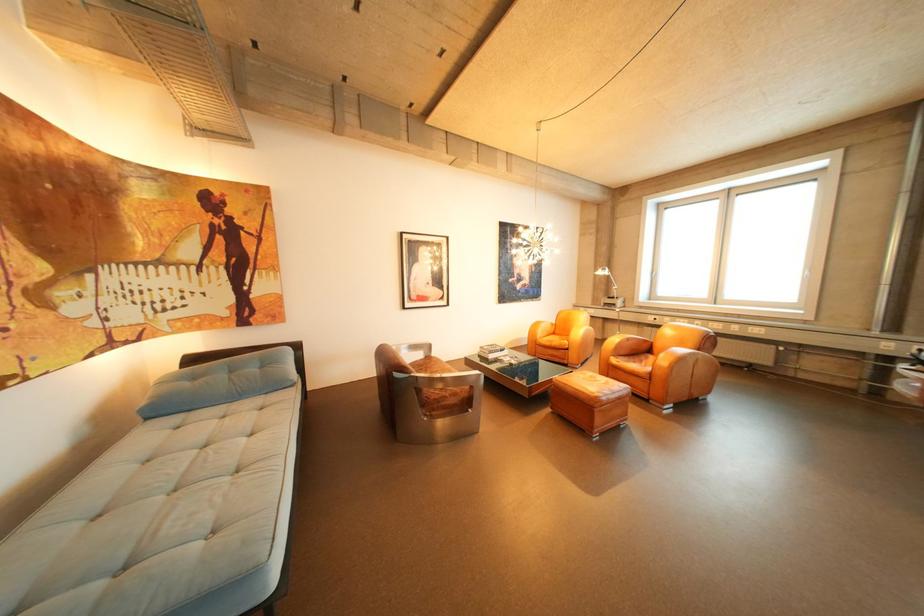
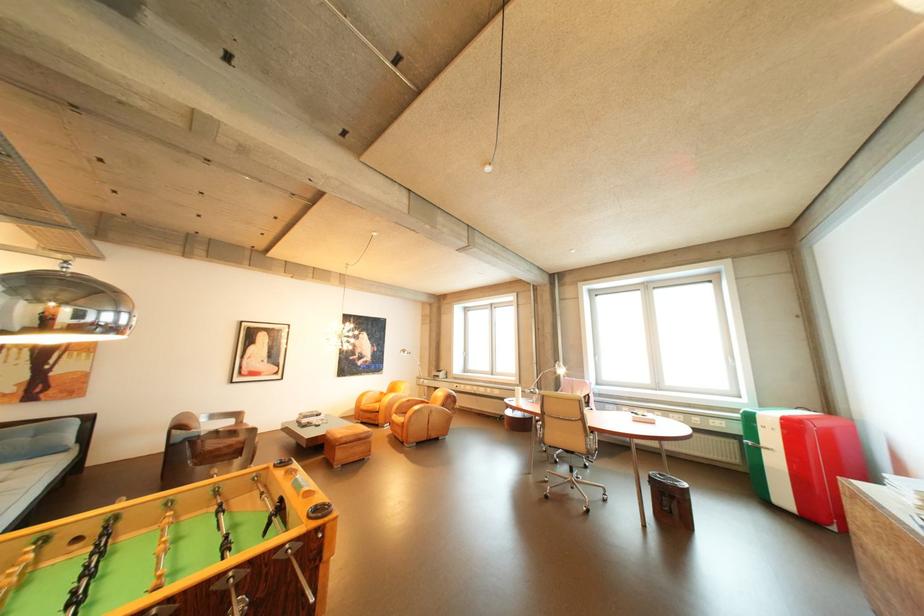
Find the pixel in the second image that matches (552,336) in the first image.

(377, 403)